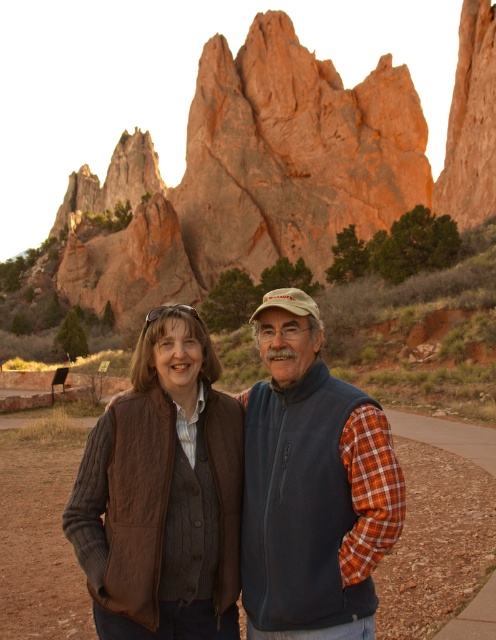
Question: Does brown leather vest at center have a larger size compared to blue fleece vest at center?

Choices:
 (A) yes
 (B) no

Answer: (B)

Question: Which point appears closest to the camera in this image?

Choices:
 (A) (234, 525)
 (B) (255, 492)

Answer: (A)

Question: Which of the following is the farthest from the observer?

Choices:
 (A) brown leather vest at center
 (B) blue fleece vest at center

Answer: (A)

Question: Considering the relative positions of brown leather vest at center and blue fleece vest at center in the image provided, where is brown leather vest at center located with respect to blue fleece vest at center?

Choices:
 (A) left
 (B) right

Answer: (A)

Question: Is brown leather vest at center to the left of blue fleece vest at center from the viewer's perspective?

Choices:
 (A) yes
 (B) no

Answer: (A)

Question: Which of the following is the farthest from the observer?

Choices:
 (A) brown leather vest at center
 (B) blue fleece vest at center

Answer: (A)